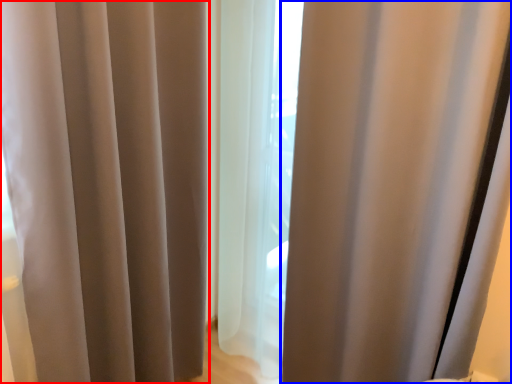
Question: Which object appears closest to the camera in this image, curtain (highlighted by a red box) or curtain (highlighted by a blue box)?

Choices:
 (A) curtain
 (B) curtain

Answer: (A)